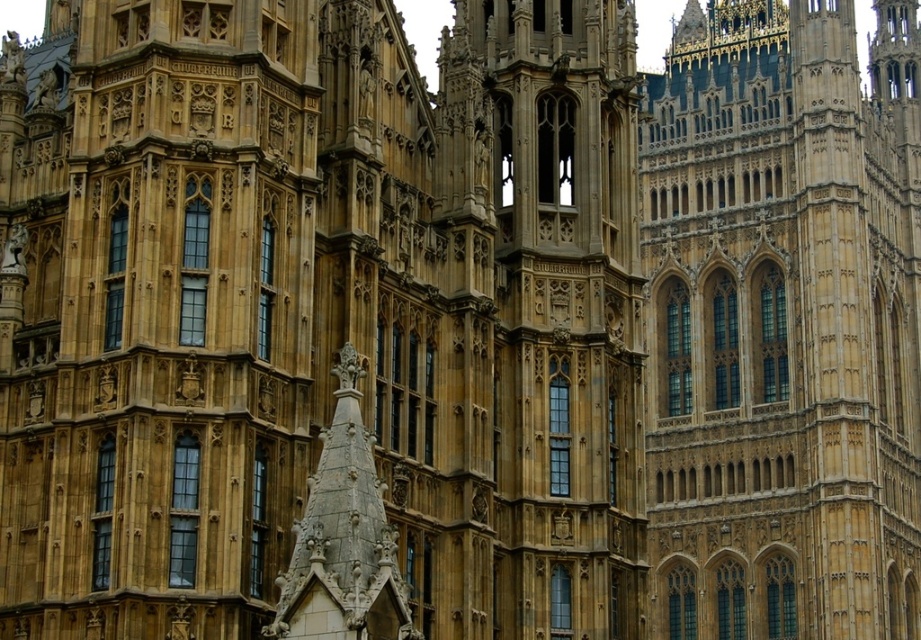
Who is positioned more to the left, golden stone tower at upper right or golden stone tower at center?

golden stone tower at center

At what (x,y) coordinates should I click in order to perform the action: click on golden stone tower at upper right. Please return your answer as a coordinate pair (x, y). The image size is (921, 640). Looking at the image, I should click on (783, 323).

Is point (775, 56) positioned before point (592, 488)?

No, it is not.

Locate an element on the screen. golden stone tower at upper right is located at coordinates (783, 323).